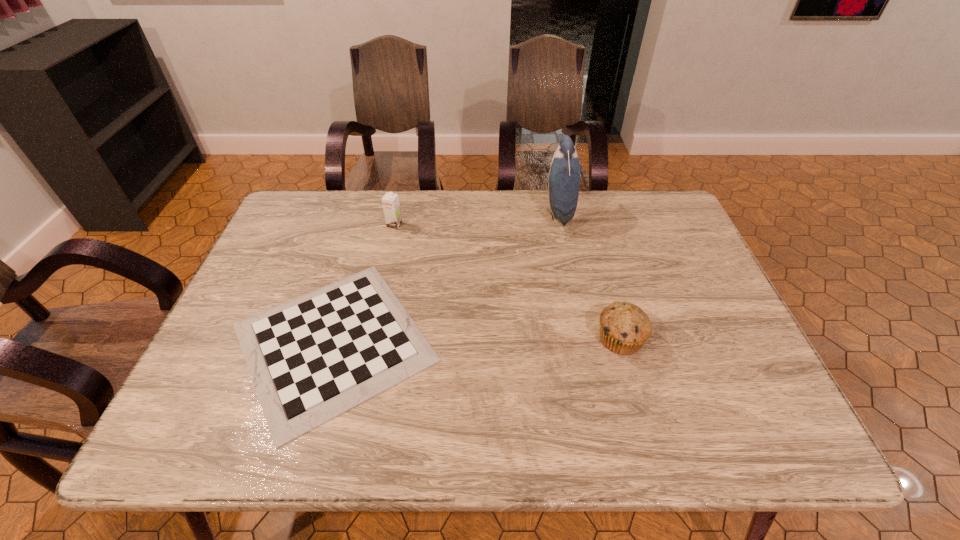
Choose which object is the third nearest neighbor to the chocolate milk. Please provide its 2D coordinates. Your answer should be formatted as a tuple, i.e. [(x, y)], where the tuple contains the x and y coordinates of a point satisfying the conditions above.

[(624, 328)]

Identify the location of free space in the image that satisfies the following two spatial constraints: 1. on the front side of the chocolate milk; 2. on the left side of the muffin. (370, 339).

This screenshot has height=540, width=960. I want to click on vacant area in the image that satisfies the following two spatial constraints: 1. on the back side of the muffin; 2. on the right side of the shortest object, so click(335, 339).

At what (x,y) coordinates should I click in order to perform the action: click on vacant position in the image that satisfies the following two spatial constraints: 1. at the tip of the tallest object's beak; 2. on the back side of the muffin. Please return your answer as a coordinate pair (x, y). The height and width of the screenshot is (540, 960). Looking at the image, I should click on (584, 339).